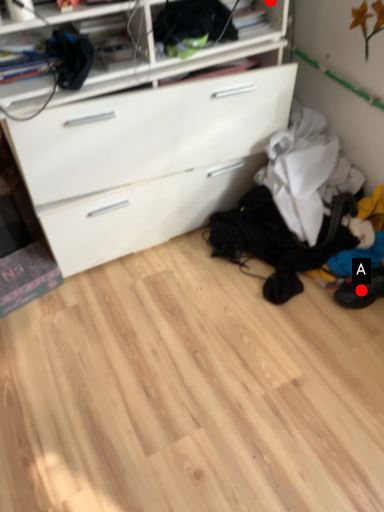
Question: Two points are circled on the image, labeled by A and B beside each circle. Which point is further to the camera?

Choices:
 (A) A is further
 (B) B is further

Answer: (B)